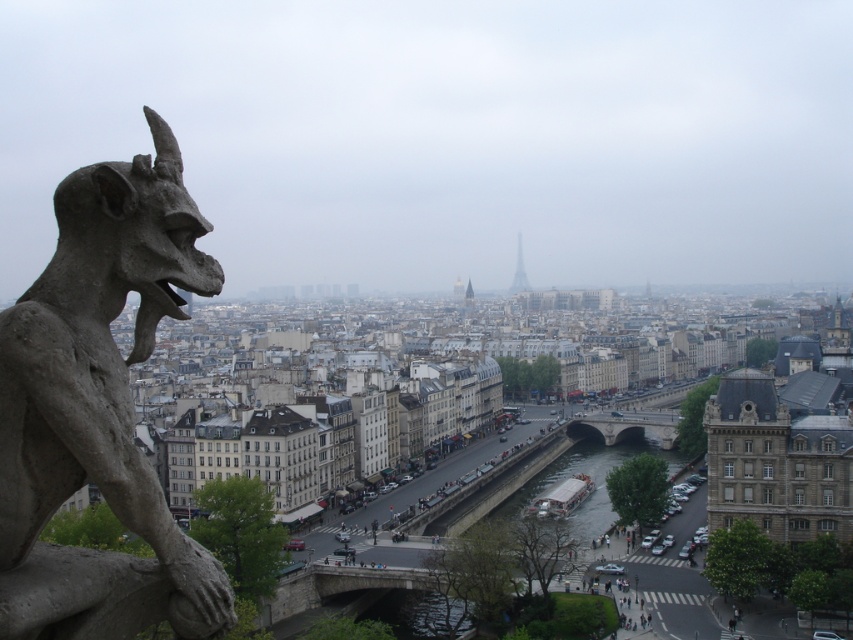
Is point (39, 624) positioned behind point (519, 244)?

No, (39, 624) is closer to viewer.

Can you confirm if gray stone gargoyle at left is wider than metallic silver tower at center?

No, gray stone gargoyle at left is not wider than metallic silver tower at center.

The height and width of the screenshot is (640, 853). Identify the location of gray stone gargoyle at left. (99, 408).